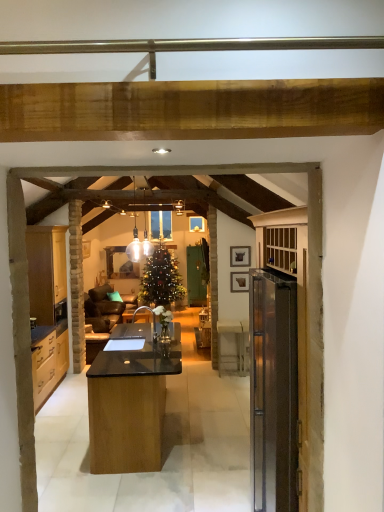
Describe the element at coordinates (139, 245) in the screenshot. I see `white glass pendant light at center` at that location.

The image size is (384, 512). Describe the element at coordinates (239, 281) in the screenshot. I see `wooden picture frame at upper right, which is the second picture frame from top to bottom` at that location.

Describe the element at coordinates (48, 308) in the screenshot. The width and height of the screenshot is (384, 512). I see `matte wood cabinets at left` at that location.

The image size is (384, 512). Identify the location of white glass pendant light at center. (139, 245).

Does wooden picture frame at upper right, which is the second picture frame from top to bottom, have a larger size compared to matte black picture frame at upper center, the 2th picture frame positioned from the bottom?

Indeed, wooden picture frame at upper right, which is the second picture frame from top to bottom, has a larger size compared to matte black picture frame at upper center, the 2th picture frame positioned from the bottom.

From the picture: Is wooden picture frame at upper right, the 1th picture frame ordered from the bottom, facing towards matte black picture frame at upper center, the 1th picture frame in the top-to-bottom sequence?

No, wooden picture frame at upper right, the 1th picture frame ordered from the bottom, is not turned towards matte black picture frame at upper center, the 1th picture frame in the top-to-bottom sequence.

Is wooden picture frame at upper right, which is the second picture frame from top to bottom, located outside matte black picture frame at upper center, the 1th picture frame in the top-to-bottom sequence?

wooden picture frame at upper right, which is the second picture frame from top to bottom, is positioned outside matte black picture frame at upper center, the 1th picture frame in the top-to-bottom sequence.

Between white glass pendant light at center and matte black picture frame at upper center, the 1th picture frame in the top-to-bottom sequence, which one has less height?

matte black picture frame at upper center, the 1th picture frame in the top-to-bottom sequence.

In the scene shown: Which is more to the left, white glass pendant light at center or matte black picture frame at upper center, the 1th picture frame in the top-to-bottom sequence?

white glass pendant light at center.

Identify the location of lamp above the matte black picture frame at upper center, the 2th picture frame positioned from the bottom (from a real-world perspective). The width and height of the screenshot is (384, 512). (139, 245).

From the image's perspective, is white glass pendant light at center located above or below matte black picture frame at upper center, the 2th picture frame positioned from the bottom?

From the image's perspective, white glass pendant light at center appears above matte black picture frame at upper center, the 2th picture frame positioned from the bottom.

Is point (235, 266) positioned in front of point (233, 287)?

No.

Which object is positioned more to the left, matte black picture frame at upper center, the 2th picture frame positioned from the bottom, or wooden picture frame at upper right, which is the second picture frame from top to bottom?

matte black picture frame at upper center, the 2th picture frame positioned from the bottom, is more to the left.

In the image, there is a matte black picture frame at upper center, the 1th picture frame in the top-to-bottom sequence. Find the location of `picture frame below it (from a real-world perspective)`. picture frame below it (from a real-world perspective) is located at coordinates (239, 281).

Which object is closer to the camera, matte black picture frame at upper center, the 2th picture frame positioned from the bottom, or wooden picture frame at upper right, the 1th picture frame ordered from the bottom?

matte black picture frame at upper center, the 2th picture frame positioned from the bottom, is in front.

Is matte black picture frame at upper center, the 2th picture frame positioned from the bottom, located within matte wood cabinets at left?

No, matte black picture frame at upper center, the 2th picture frame positioned from the bottom, is located outside of matte wood cabinets at left.

Looking at this image, which of these two, matte wood cabinets at left or matte black picture frame at upper center, the 1th picture frame in the top-to-bottom sequence, is wider?

Wider between the two is matte wood cabinets at left.

Consider the image. Can you see matte wood cabinets at left touching matte black picture frame at upper center, the 2th picture frame positioned from the bottom?

matte wood cabinets at left is not next to matte black picture frame at upper center, the 2th picture frame positioned from the bottom, and they're not touching.

Is matte wood cabinets at left positioned before white glass pendant light at center?

No.

From the image's perspective, between matte wood cabinets at left and white glass pendant light at center, which one is located above?

white glass pendant light at center, from the image's perspective.

Is matte wood cabinets at left facing away from white glass pendant light at center?

No, matte wood cabinets at left is not facing the opposite direction of white glass pendant light at center.

From a real-world perspective, is matte wood cabinets at left physically above white glass pendant light at center?

Incorrect, from a real-world perspective, matte wood cabinets at left is lower than white glass pendant light at center.

From the image's perspective, which is below, matte wood cabinets at left or wooden picture frame at upper right, which is the second picture frame from top to bottom?

matte wood cabinets at left, from the image's perspective.

Can you confirm if matte wood cabinets at left is bigger than wooden picture frame at upper right, the 1th picture frame ordered from the bottom?

Correct, matte wood cabinets at left is larger in size than wooden picture frame at upper right, the 1th picture frame ordered from the bottom.

Is matte wood cabinets at left to the left or to the right of wooden picture frame at upper right, which is the second picture frame from top to bottom, in the image?

Based on their positions, matte wood cabinets at left is located to the left of wooden picture frame at upper right, which is the second picture frame from top to bottom.

Is matte wood cabinets at left situated inside wooden picture frame at upper right, the 1th picture frame ordered from the bottom, or outside?

matte wood cabinets at left is not inside wooden picture frame at upper right, the 1th picture frame ordered from the bottom, it's outside.

From the image's perspective, is wooden picture frame at upper right, the 1th picture frame ordered from the bottom, positioned above or below white glass pendant light at center?

From the image's perspective, wooden picture frame at upper right, the 1th picture frame ordered from the bottom, appears below white glass pendant light at center.

Who is more distant, wooden picture frame at upper right, the 1th picture frame ordered from the bottom, or white glass pendant light at center?

wooden picture frame at upper right, the 1th picture frame ordered from the bottom, is more distant.

Is wooden picture frame at upper right, the 1th picture frame ordered from the bottom, next to white glass pendant light at center?

wooden picture frame at upper right, the 1th picture frame ordered from the bottom, and white glass pendant light at center are clearly separated.

Where is `picture frame beneath the matte black picture frame at upper center, the 2th picture frame positioned from the bottom (from a real-world perspective)`? The image size is (384, 512). picture frame beneath the matte black picture frame at upper center, the 2th picture frame positioned from the bottom (from a real-world perspective) is located at coordinates [x=239, y=281].

Which picture frame is the 1st one when counting from the right side of the white glass pendant light at center? Please provide its 2D coordinates.

[(240, 256)]

Which object lies further to the anchor point matte black picture frame at upper center, the 2th picture frame positioned from the bottom, matte wood cabinets at left or wooden picture frame at upper right, which is the second picture frame from top to bottom?

matte wood cabinets at left lies further to matte black picture frame at upper center, the 2th picture frame positioned from the bottom, than the other object.

Considering their positions, is wooden picture frame at upper right, the 1th picture frame ordered from the bottom, positioned further to matte wood cabinets at left than white glass pendant light at center?

Based on the image, wooden picture frame at upper right, the 1th picture frame ordered from the bottom, appears to be further to matte wood cabinets at left.

Which object lies further to the anchor point matte wood cabinets at left, matte black picture frame at upper center, the 2th picture frame positioned from the bottom, or wooden picture frame at upper right, the 1th picture frame ordered from the bottom?

matte black picture frame at upper center, the 2th picture frame positioned from the bottom.

From the image, which object appears to be farther from wooden picture frame at upper right, which is the second picture frame from top to bottom, white glass pendant light at center or matte black picture frame at upper center, the 1th picture frame in the top-to-bottom sequence?

white glass pendant light at center is positioned further to the anchor wooden picture frame at upper right, which is the second picture frame from top to bottom.

Looking at the image, which one is located further to matte wood cabinets at left, white glass pendant light at center or wooden picture frame at upper right, the 1th picture frame ordered from the bottom?

wooden picture frame at upper right, the 1th picture frame ordered from the bottom.

Which object lies further to the anchor point white glass pendant light at center, wooden picture frame at upper right, the 1th picture frame ordered from the bottom, or matte black picture frame at upper center, the 2th picture frame positioned from the bottom?

wooden picture frame at upper right, the 1th picture frame ordered from the bottom, is positioned further to the anchor white glass pendant light at center.

When comparing their distances from matte black picture frame at upper center, the 1th picture frame in the top-to-bottom sequence, does wooden picture frame at upper right, which is the second picture frame from top to bottom, or matte wood cabinets at left seem further?

matte wood cabinets at left is positioned further to the anchor matte black picture frame at upper center, the 1th picture frame in the top-to-bottom sequence.

Looking at the image, which one is located closer to white glass pendant light at center, matte black picture frame at upper center, the 2th picture frame positioned from the bottom, or matte wood cabinets at left?

matte wood cabinets at left is closer to white glass pendant light at center.

You are a GUI agent. You are given a task and a screenshot of the screen. Output one action in this format:
    pyautogui.click(x=<x>, y=<y>)
    Task: Click on the picture frame between matte wood cabinets at left and wooden picture frame at upper right, which is the second picture frame from top to bottom
    
    Given the screenshot: What is the action you would take?
    pyautogui.click(x=240, y=256)

Locate an element on the screen. The width and height of the screenshot is (384, 512). picture frame between white glass pendant light at center and wooden picture frame at upper right, the 1th picture frame ordered from the bottom, along the z-axis is located at coordinates (240, 256).

You are a GUI agent. You are given a task and a screenshot of the screen. Output one action in this format:
    pyautogui.click(x=<x>, y=<y>)
    Task: Click on the lamp situated between matte wood cabinets at left and wooden picture frame at upper right, the 1th picture frame ordered from the bottom, from left to right
    
    Given the screenshot: What is the action you would take?
    pyautogui.click(x=139, y=245)

Identify the location of lamp located between matte wood cabinets at left and matte black picture frame at upper center, the 1th picture frame in the top-to-bottom sequence, in the left-right direction. This screenshot has height=512, width=384. (139, 245).